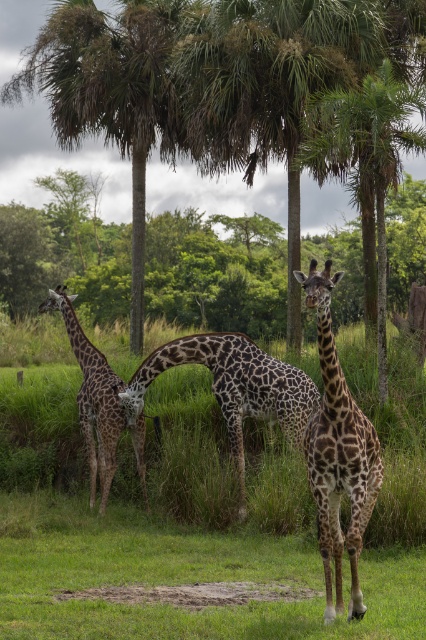
Can you confirm if green leafy tree at center is taller than spotted fur giraffe at center?

Correct, green leafy tree at center is much taller as spotted fur giraffe at center.

Measure the distance between point [230,28] and camera.

Point [230,28] is 21.56 meters away from camera.

Locate an element on the screen. The image size is (426, 640). green leafy tree at center is located at coordinates (209, 84).

From the picture: Is spotted fur giraffe at center closer to camera compared to spotted fur giraffe at left?

Yes, spotted fur giraffe at center is in front of spotted fur giraffe at left.

Which is in front, point (322, 296) or point (94, 419)?

Point (322, 296) is more forward.

Where is `spotted fur giraffe at center`? This screenshot has width=426, height=640. spotted fur giraffe at center is located at coordinates (337, 452).

Which is more to the left, green leafy palm tree at upper center or spotted brown giraffe at center?

spotted brown giraffe at center is more to the left.

Locate an element on the screen. The image size is (426, 640). green leafy palm tree at upper center is located at coordinates (267, 86).

Locate an element on the screen. green leafy palm tree at upper center is located at coordinates (267, 86).